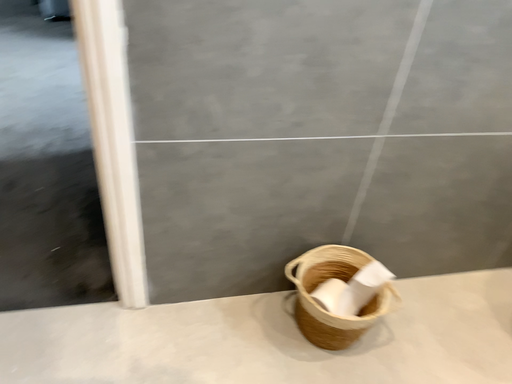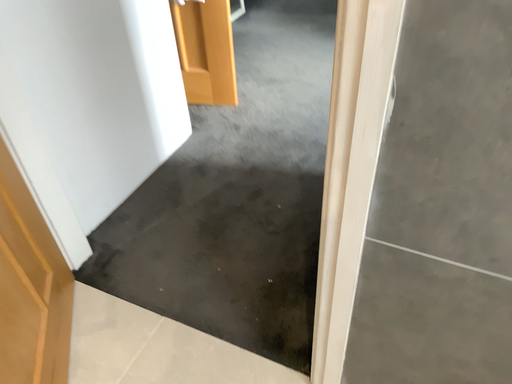
Question: How did the camera likely rotate when shooting the video?

Choices:
 (A) rotated right
 (B) rotated left

Answer: (B)